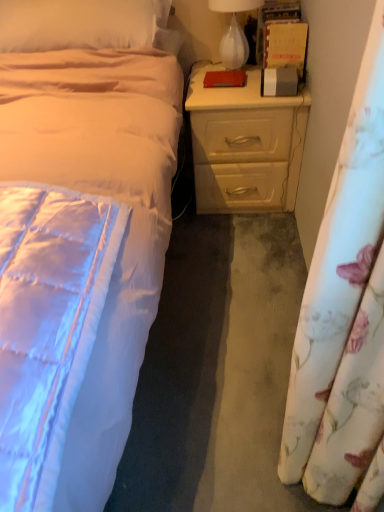
I want to click on free space behind floral fabric curtain at right, so click(x=248, y=371).